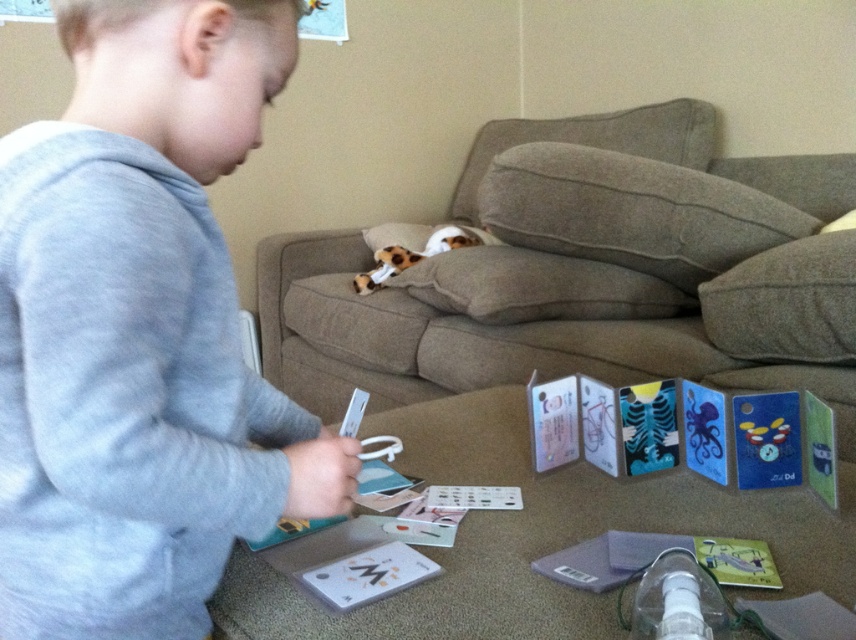
Between brown fabric couch at center and white matte card at lower center, which one appears on the right side from the viewer's perspective?

brown fabric couch at center is more to the right.

What do you see at coordinates (586, 276) in the screenshot?
I see `brown fabric couch at center` at bounding box center [586, 276].

Locate an element on the screen. Image resolution: width=856 pixels, height=640 pixels. brown fabric couch at center is located at coordinates (586, 276).

The width and height of the screenshot is (856, 640). I want to click on brown fabric couch at center, so click(x=586, y=276).

Is white matte card at lower center above cheetah-print plush at center?

Incorrect, white matte card at lower center is not positioned above cheetah-print plush at center.

Does white matte card at lower center have a lesser width compared to cheetah-print plush at center?

Yes.

Is point (311, 589) positioned behind point (361, 292)?

No, it is in front of (361, 292).

Where is `white matte card at lower center`? The width and height of the screenshot is (856, 640). white matte card at lower center is located at coordinates (367, 576).

Between gray cotton shirt at upper left and brown fabric couch at center, which one is positioned lower?

Positioned lower is gray cotton shirt at upper left.

Who is more forward, (91,45) or (807,308)?

Point (91,45) is more forward.

The height and width of the screenshot is (640, 856). I want to click on gray cotton shirt at upper left, so click(140, 330).